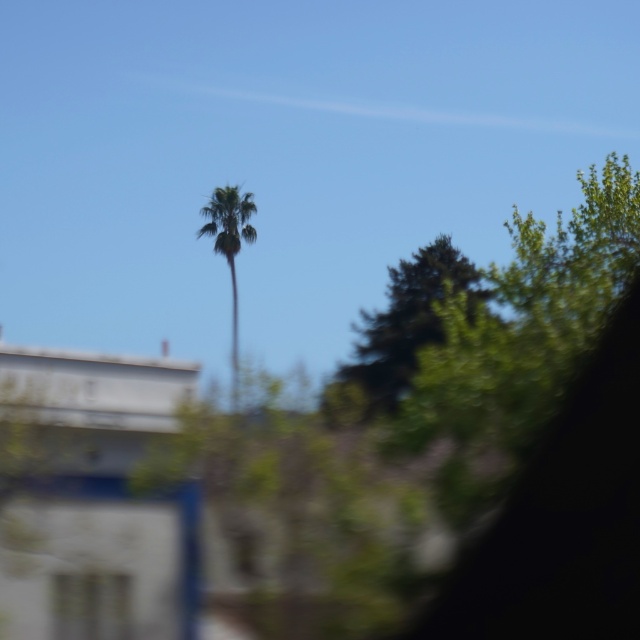
Describe the element at coordinates (397, 333) in the screenshot. This screenshot has width=640, height=640. I see `green leafy tree at center` at that location.

Is the position of green leafy tree at center more distant than that of transparent glass car window at lower left?

Yes, green leafy tree at center is further from the viewer.

Is point (467, 266) positioned after point (60, 576)?

That is True.

Locate an element on the screen. green leafy tree at center is located at coordinates (397, 333).

Can you confirm if green leafy tree at center is bigger than green leafy palm tree at center?

Incorrect, green leafy tree at center is not larger than green leafy palm tree at center.

Where is `green leafy tree at center`? green leafy tree at center is located at coordinates (397, 333).

The width and height of the screenshot is (640, 640). I want to click on green leafy tree at center, so click(x=397, y=333).

Is transparent glass car window at lower left further to the viewer compared to green leafy palm tree at center?

No, transparent glass car window at lower left is closer to the viewer.

Is point (90, 579) in front of point (208, 208)?

Yes, point (90, 579) is closer to viewer.

Locate an element on the screen. This screenshot has height=640, width=640. transparent glass car window at lower left is located at coordinates (92, 605).